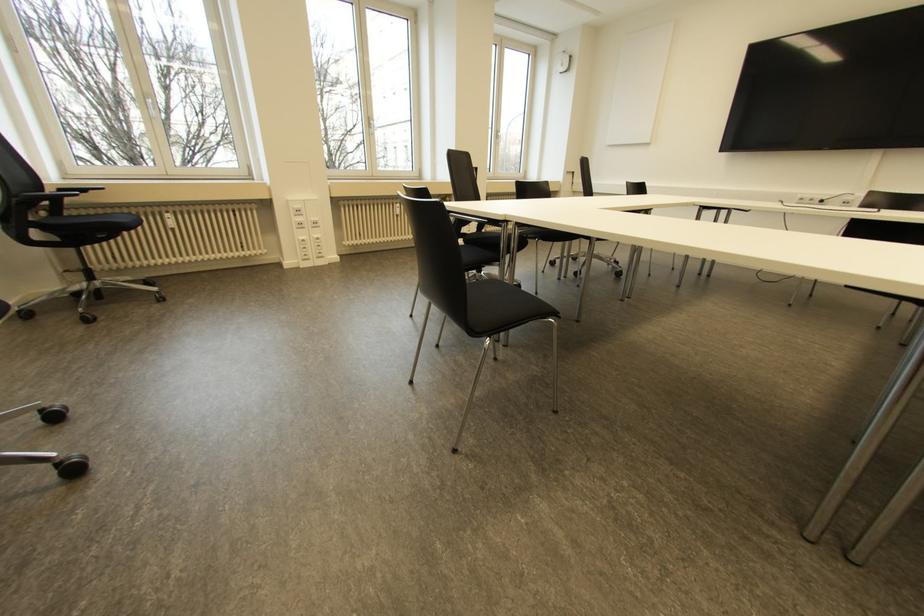
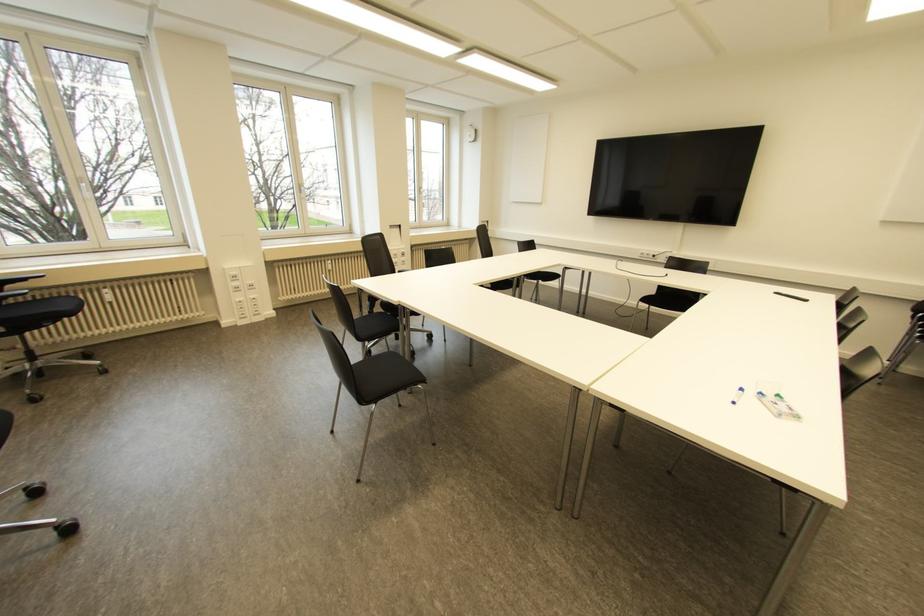
The images are taken continuously from a first-person perspective. In which direction are you moving?

The movement direction of the cameraman is right, backward.